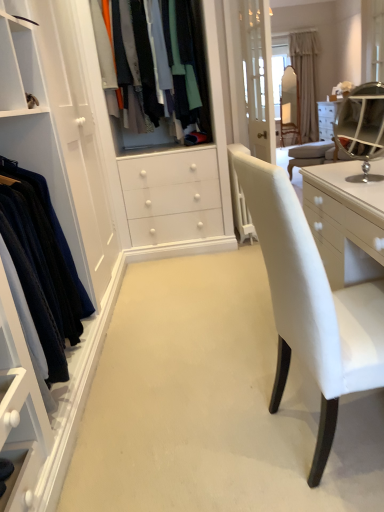
Question: Is point (345, 150) closer or farther from the camera than point (306, 81)?

Choices:
 (A) closer
 (B) farther

Answer: (A)

Question: From the image's perspective, is silver/metallic vanity mirror at upper right positioned above or below beige fabric curtain at upper center?

Choices:
 (A) below
 (B) above

Answer: (A)

Question: Which object is the farthest from the silver/metallic vanity mirror at upper right?

Choices:
 (A) matte fabric shirts at center, which appears as the 1th clothing when viewed from the back
 (B) beige fabric curtain at upper center
 (C) velvet blue sweater at left, marked as the first clothing in a front-to-back arrangement

Answer: (B)

Question: Estimate the real-world distances between objects in this image. Which object is farther from the beige fabric curtain at upper center?

Choices:
 (A) matte fabric shirts at center, arranged as the 1th clothing when viewed from the top
 (B) silver/metallic vanity mirror at upper right
 (C) velvet blue sweater at left, the second clothing positioned from the top

Answer: (C)